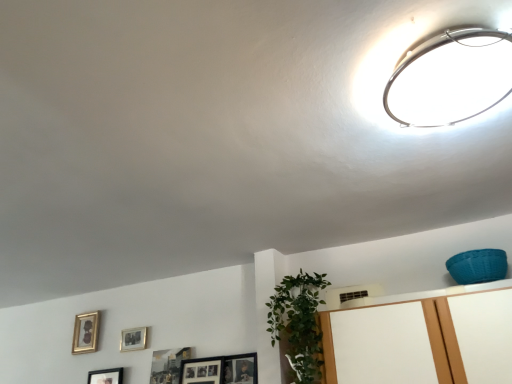
Question: Is gold metallic picture frame at lower left, the 4th picture frame in the right-to-left sequence, touching metallic ring light at upper right?

Choices:
 (A) yes
 (B) no

Answer: (B)

Question: Is gold metallic picture frame at lower left, the 4th picture frame in the right-to-left sequence, closer to the viewer compared to metallic ring light at upper right?

Choices:
 (A) yes
 (B) no

Answer: (B)

Question: From a real-world perspective, is gold metallic picture frame at lower left, which is the 1th picture frame from left to right, on top of metallic ring light at upper right?

Choices:
 (A) yes
 (B) no

Answer: (B)

Question: Is metallic ring light at upper right located within gold metallic picture frame at lower left, the 4th picture frame in the right-to-left sequence?

Choices:
 (A) yes
 (B) no

Answer: (B)

Question: Is gold metallic picture frame at lower left, which is the 1th picture frame from left to right, positioned beyond the bounds of metallic ring light at upper right?

Choices:
 (A) yes
 (B) no

Answer: (A)

Question: Would you say metallic ring light at upper right is inside or outside matte silver picture frame at upper center, which appears as the second picture frame when viewed from the right?

Choices:
 (A) outside
 (B) inside

Answer: (A)

Question: Is point (411, 76) closer or farther from the camera than point (123, 347)?

Choices:
 (A) farther
 (B) closer

Answer: (B)

Question: From the image's perspective, is metallic ring light at upper right located above or below matte silver picture frame at upper center, which is the third picture frame from left to right?

Choices:
 (A) below
 (B) above

Answer: (B)

Question: Visually, is metallic ring light at upper right positioned to the left or to the right of matte silver picture frame at upper center, which appears as the second picture frame when viewed from the right?

Choices:
 (A) right
 (B) left

Answer: (A)

Question: Considering their positions, is matte silver picture frame at upper center, which appears as the second picture frame when viewed from the right, located in front of or behind metallic ring light at upper right?

Choices:
 (A) behind
 (B) front

Answer: (A)

Question: Based on their sizes in the image, would you say matte silver picture frame at upper center, which is the third picture frame from left to right, is bigger or smaller than metallic ring light at upper right?

Choices:
 (A) big
 (B) small

Answer: (B)

Question: From a real-world perspective, is matte silver picture frame at upper center, which appears as the second picture frame when viewed from the right, positioned above or below metallic ring light at upper right?

Choices:
 (A) above
 (B) below

Answer: (B)

Question: Is point (144, 327) closer or farther from the camera than point (437, 87)?

Choices:
 (A) farther
 (B) closer

Answer: (A)

Question: Is gold metallic picture frame at lower left, which is the 1th picture frame from left to right, spatially inside matte silver picture frame at upper center, which appears as the second picture frame when viewed from the right, or outside of it?

Choices:
 (A) outside
 (B) inside

Answer: (A)

Question: Is gold metallic picture frame at lower left, which is the 1th picture frame from left to right, taller or shorter than matte silver picture frame at upper center, which appears as the second picture frame when viewed from the right?

Choices:
 (A) short
 (B) tall

Answer: (B)